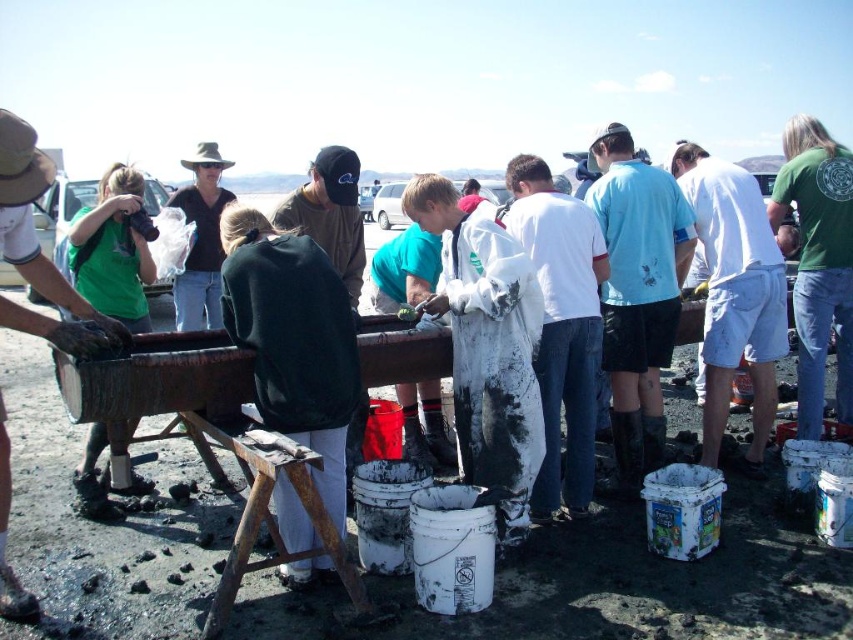
Question: Among these objects, which one is farthest from the camera?

Choices:
 (A) light blue t-shirt at center
 (B) matte black shirt at left

Answer: (A)

Question: Estimate the real-world distances between objects in this image. Which object is farther from the rusty wood stool at lower center?

Choices:
 (A) white matte t-shirt at center
 (B) matte black shirt at left

Answer: (A)

Question: Does white matte t-shirt at center appear on the left side of dark green jacket at center?

Choices:
 (A) no
 (B) yes

Answer: (A)

Question: Considering the relative positions of light blue t-shirt at center and rusty wood stool at lower center in the image provided, where is light blue t-shirt at center located with respect to rusty wood stool at lower center?

Choices:
 (A) left
 (B) right

Answer: (B)

Question: Which object is positioned closest to the rusty wood stool at lower center?

Choices:
 (A) matte black shirt at left
 (B) light blue t-shirt at center

Answer: (A)

Question: Is white cotton shirt at center thinner than rusty wood stool at lower center?

Choices:
 (A) yes
 (B) no

Answer: (A)